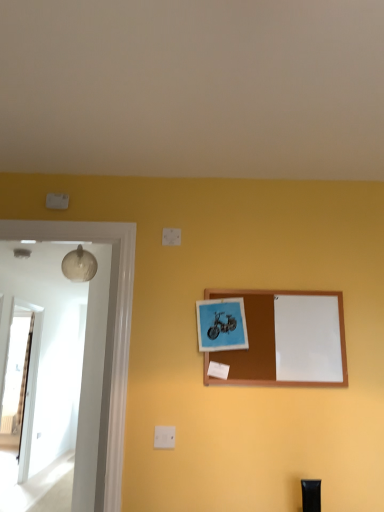
Question: Considering their positions, is transparent glass door at left located in front of or behind wooden corkboard at center, the 2th picture frame in the left-to-right sequence?

Choices:
 (A) front
 (B) behind

Answer: (B)

Question: From a real-world perspective, relative to wooden corkboard at center, which ranks as the 1th picture frame in right-to-left order, is transparent glass door at left vertically above or below?

Choices:
 (A) below
 (B) above

Answer: (A)

Question: Which of these objects is positioned farthest from the transparent glass door at left?

Choices:
 (A) matte blue picture frame at center, which is the 1th picture frame from left to right
 (B) black plastic tube at lower right
 (C) wooden corkboard at center, which ranks as the 1th picture frame in right-to-left order

Answer: (B)

Question: Estimate the real-world distances between objects in this image. Which object is closer to the black plastic tube at lower right?

Choices:
 (A) matte blue picture frame at center, the 2th picture frame when ordered from right to left
 (B) wooden corkboard at center, the 2th picture frame in the left-to-right sequence
 (C) transparent glass door at left

Answer: (B)